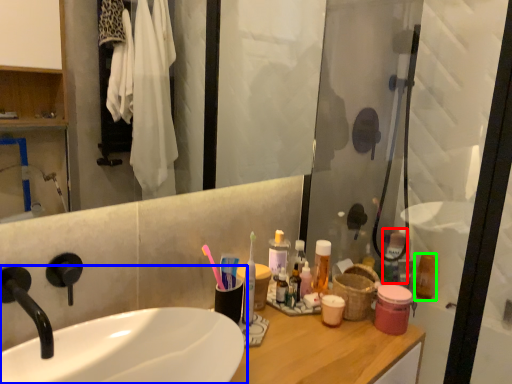
Question: Estimate the real-world distances between objects in this image. Which object is closer to mouthwash (highlighted by a red box), sink (highlighted by a blue box) or mouthwash (highlighted by a green box)?

Choices:
 (A) sink
 (B) mouthwash

Answer: (B)